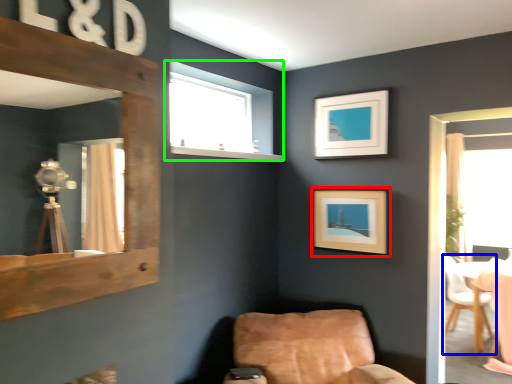
Question: Based on their relative distances, which object is nearer to picture frame (highlighted by a red box)? Choose from chair (highlighted by a blue box) and window (highlighted by a green box).

Choices:
 (A) chair
 (B) window

Answer: (B)